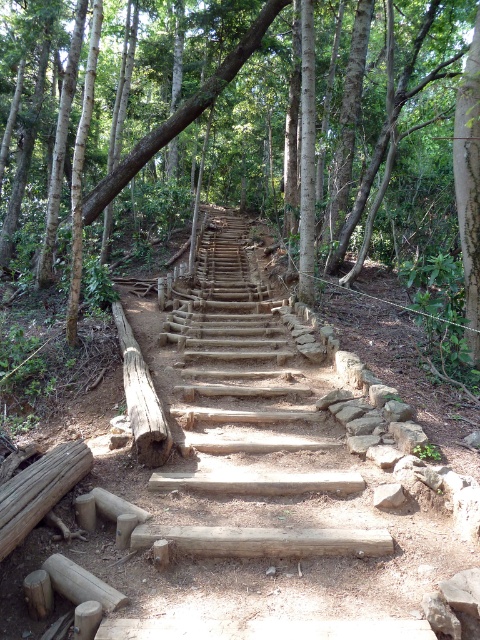
You are standing at the bottom of the natural wood stairs at center in a forest. If you were to walk straight ahead, would you be moving towards the top of the stairs or away from them?

Since the natural wood stairs at center are positioned at point coordinates, walking straight ahead from the bottom would lead you towards the top of the stairs as the stairs are central in the image.

You are standing at the base of the rustic wooden staircase in the forest. You notice two points marked on the path ahead. The first point is at coordinates point (38, 516), and the second is at point (127, 355). Which point is closer to you as you face the staircase?

Point (38, 516) is in front of point (127, 355), so the first point is closer to you.